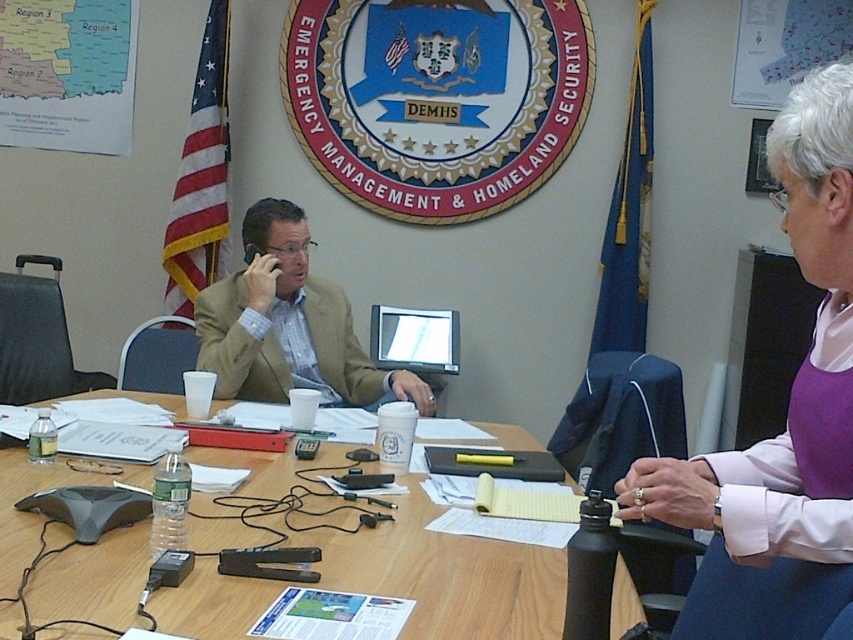
You are standing in the meeting room and want to place a 1.2 meter wide banner on the floor behind the wooden table at center. Will the banner fit entirely behind the table?

The wooden table at center is 1.12 meters from the camera, but the banner is 1.2 meters wide. Since the distance from the camera to the table is less than the banner width, the banner may not fit entirely behind the table without overlapping or extending beyond the space available.

You are standing in the meeting room and want to place a document on the wooden table at center. However, there is a light brown leather jacket at center on the table. Can you place the document there without moving the jacket?

The wooden table at center is located below the light brown leather jacket at center, meaning the jacket is on the table. Therefore, you cannot place the document there without moving the jacket.

From the picture: You are a service robot with a width of 1.2 meters. You need to move from the purple fabric shirt at upper right to the light brown leather jacket at center. Is there enough space for you to pass through the area between them?

The distance between the purple fabric shirt at upper right and the light brown leather jacket at center is 1.55 meters. Since the robot is 1.2 meters wide, there is sufficient space for it to pass through the gap between them.